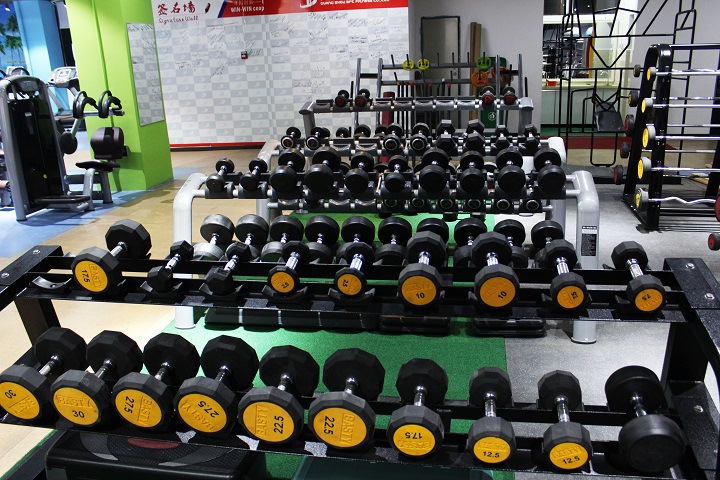
What are the coordinates of `different color floors` in the screenshot? It's located at (18, 227), (81, 233), (459, 355), (621, 344), (579, 143).